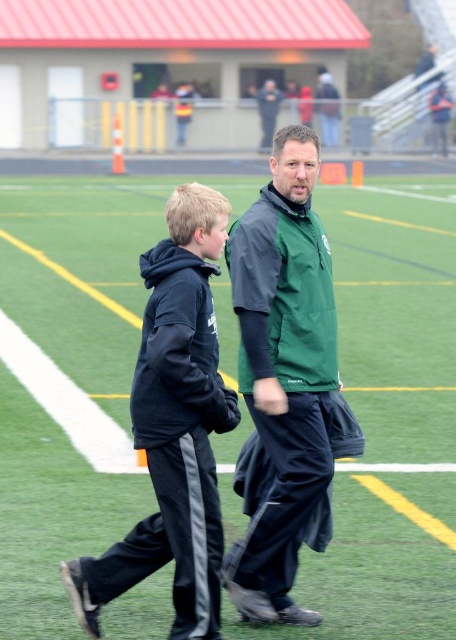
Does green matte track at center have a greater height compared to green matte jacket at center?

Yes, green matte track at center is taller than green matte jacket at center.

Based on the photo, is green matte track at center closer to camera compared to green matte jacket at center?

Yes, it is in front of green matte jacket at center.

Locate an element on the screen. green matte track at center is located at coordinates (388, 419).

I want to click on green matte track at center, so click(388, 419).

Can you confirm if green matte jacket at center is thinner than black fleece jacket at center?

Correct, green matte jacket at center's width is less than black fleece jacket at center's.

What do you see at coordinates (285, 384) in the screenshot? I see `green matte jacket at center` at bounding box center [285, 384].

Find the location of a particular element. green matte jacket at center is located at coordinates (285, 384).

Locate an element on the screen. This screenshot has width=456, height=640. green matte jacket at center is located at coordinates (285, 384).

Can you confirm if green matte track at center is bigger than black fleece jacket at center?

Indeed, green matte track at center has a larger size compared to black fleece jacket at center.

Consider the image. Who is higher up, green matte track at center or black fleece jacket at center?

green matte track at center is above.

Which is in front, point (331, 608) or point (186, 385)?

Point (186, 385) is in front.

At what (x,y) coordinates should I click in order to perform the action: click on green matte track at center. Please return your answer as a coordinate pair (x, y). Looking at the image, I should click on (388, 419).